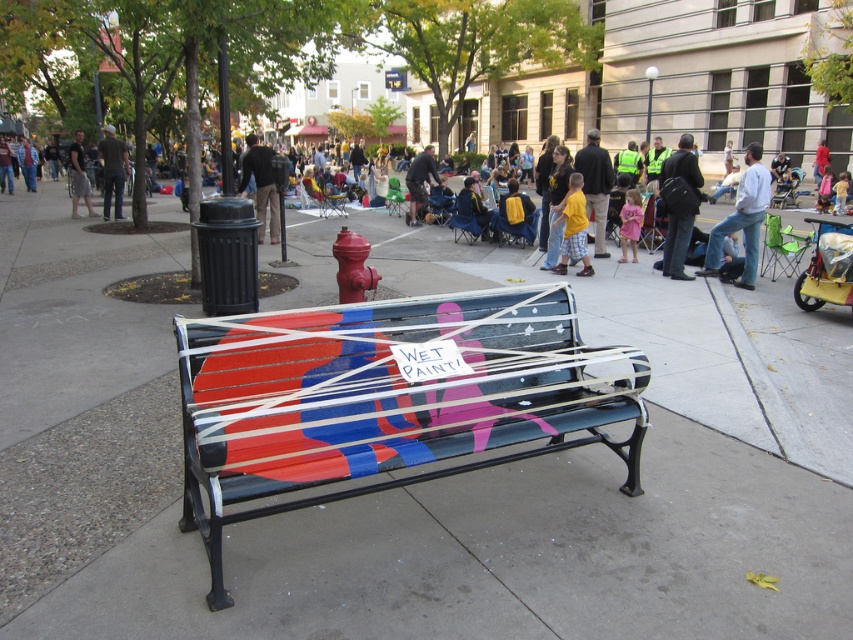
You are a photographer trying to capture a candid shot of the two people at the center of the scene. The dark gray pants at center and dark brown pants at center are standing close to each other. You want to ensure that both are in focus. Since your camera has a fixed focus range, which person should you position closer to the camera to maximize the chances of both being in focus?

You should position the dark gray pants at center closer to the camera because its width is larger than the dark brown pants at center. This way, the camera can better accommodate both subjects within the focus range.

You are a photographer trying to capture a candid shot of the two people in the scene wearing dark gray pants at center and dark brown pants at center. Since you want to ensure both are visible in the frame, which person should you position closer to the camera to avoid cropping?

You should position the person wearing dark gray pants at center closer to the camera because they occupy less space and might be harder to see from a distance compared to the dark brown pants at center.